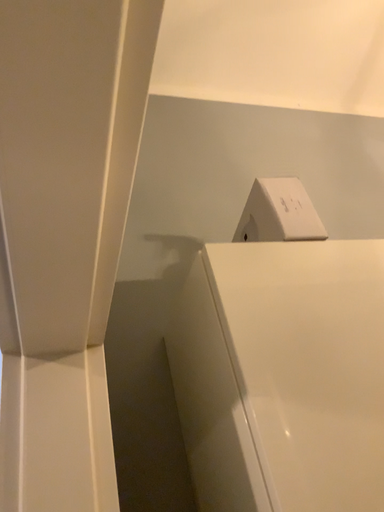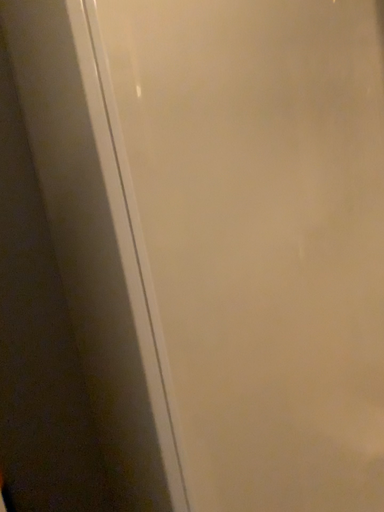
Question: How did the camera likely rotate when shooting the video?

Choices:
 (A) rotated downward
 (B) rotated upward

Answer: (A)